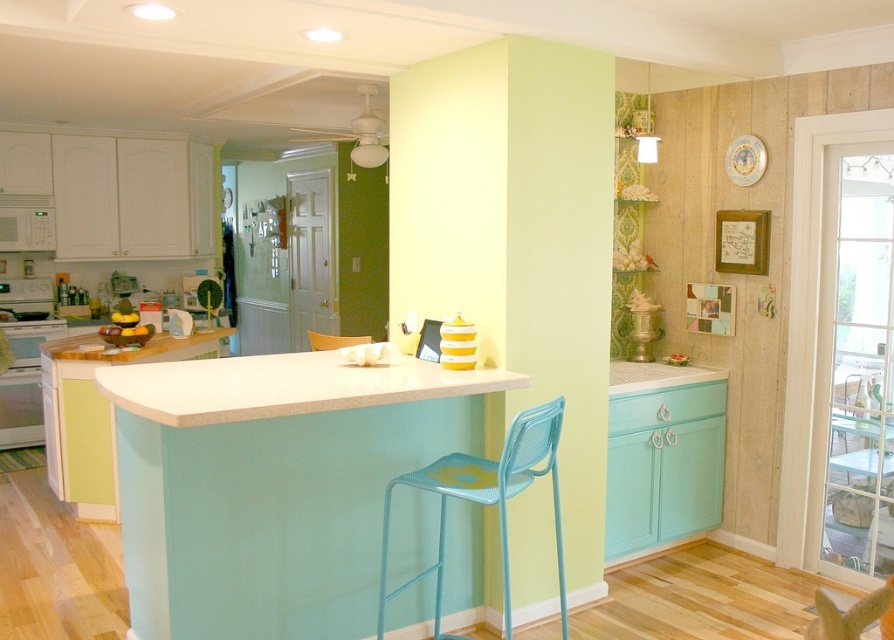
Question: Does matte turquoise bar at center lie behind matte yellow chair at center?

Choices:
 (A) yes
 (B) no

Answer: (B)

Question: Estimate the real-world distances between objects in this image. Which object is farther from the white glossy oven at left?

Choices:
 (A) light yellow smooth pillar at center
 (B) matte turquoise bar at center
 (C) white laminate counter at center

Answer: (A)

Question: Among these points, which one is nearest to the camera?

Choices:
 (A) (568, 250)
 (B) (11, 392)
 (C) (191, 435)

Answer: (C)

Question: Is light yellow smooth pillar at center to the left of white laminate counter at center from the viewer's perspective?

Choices:
 (A) yes
 (B) no

Answer: (B)

Question: Can you confirm if matte turquoise bar at center is wider than white laminate counter at center?

Choices:
 (A) no
 (B) yes

Answer: (A)

Question: Which point appears farthest from the camera in this image?

Choices:
 (A) (547, 460)
 (B) (7, 392)
 (C) (593, 184)
 (D) (197, 419)

Answer: (B)